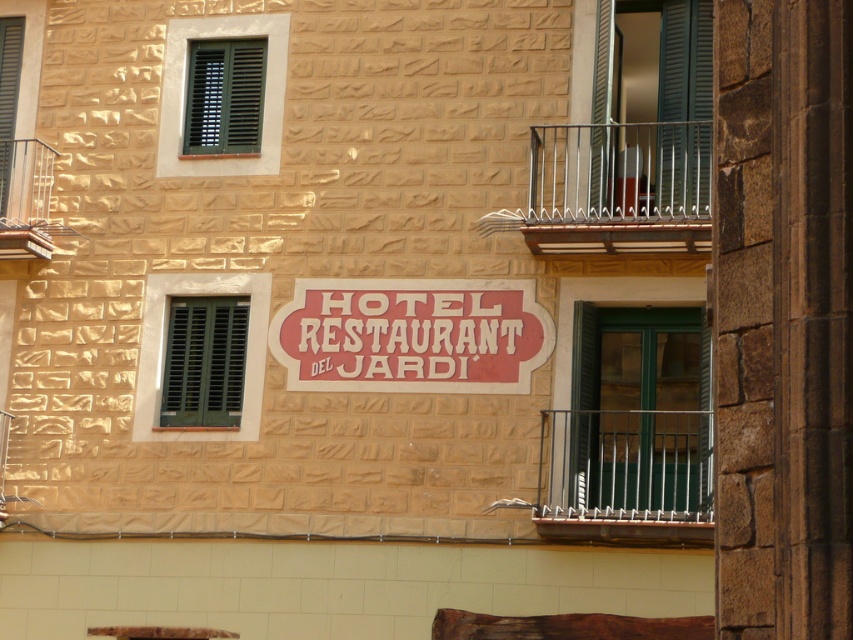
Question: Which point is closer to the camera?

Choices:
 (A) (634, 515)
 (B) (0, 116)

Answer: (A)

Question: Which point appears farthest from the camera in this image?

Choices:
 (A) (636, 476)
 (B) (196, 419)

Answer: (B)

Question: Which object is closer to the camera taking this photo?

Choices:
 (A) green matte shutter at left
 (B) green matte shutters at upper right

Answer: (B)

Question: From the image, what is the correct spatial relationship of green matte shutters at upper right in relation to green matte shutters at left?

Choices:
 (A) above
 (B) below

Answer: (A)

Question: Can you confirm if green matte shutters at upper right is positioned to the left of green matte shutter at upper left?

Choices:
 (A) yes
 (B) no

Answer: (B)

Question: Can you confirm if polished metal railing at right is smaller than silver metallic railing at upper left?

Choices:
 (A) yes
 (B) no

Answer: (B)